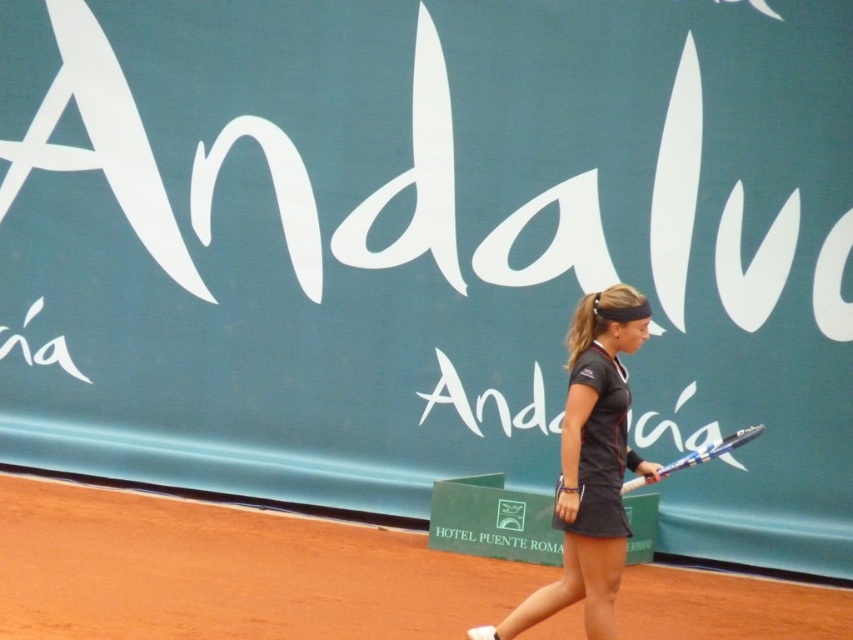
You are a photographer standing at the edge of the brown clay tennis court at center and the blue metallic racket at center. You want to take a photo of the racket while ensuring the court is visible in the background. Based on their positions, will the court appear to the left or right side of the racket in the photo?

The brown clay tennis court at center is positioned on the left side of blue metallic racket at center, so in the photo, the court will appear to the left of the racket.

You are standing on the clay court and see two points marked on the ground. One is at point (276,580) and the other is at point (486,637). Which point is closer to you?

Point (276,580) is closer to you because it is further to the viewer than point (486,637).